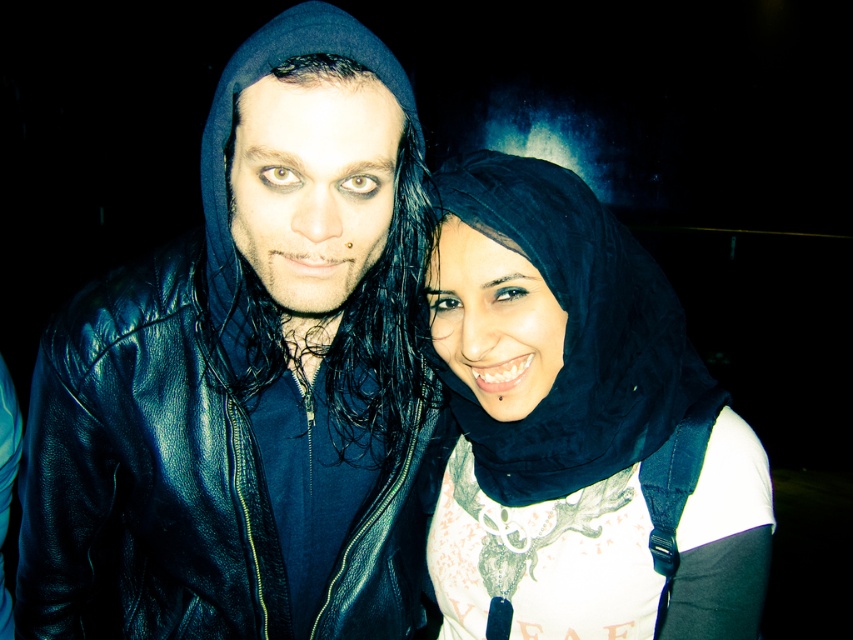
Is black leather jacket at left below black matte hijab at center?

Actually, black leather jacket at left is above black matte hijab at center.

Does point (201, 349) come behind point (653, 570)?

No, (201, 349) is in front of (653, 570).

At what (x,y) coordinates should I click in order to perform the action: click on black leather jacket at left. Please return your answer as a coordinate pair (x, y). This screenshot has height=640, width=853. Looking at the image, I should click on (252, 371).